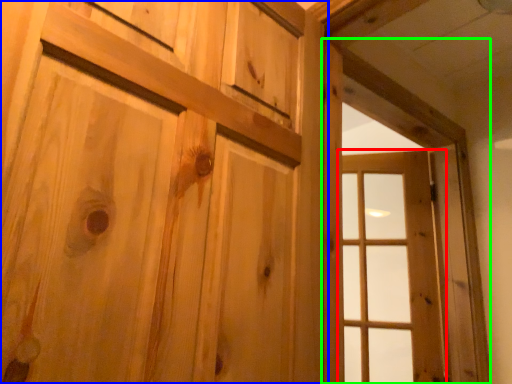
Question: Estimate the real-world distances between objects in this image. Which object is closer to window (highlighted by a red box), door (highlighted by a blue box) or window frame (highlighted by a green box)?

Choices:
 (A) door
 (B) window frame

Answer: (B)